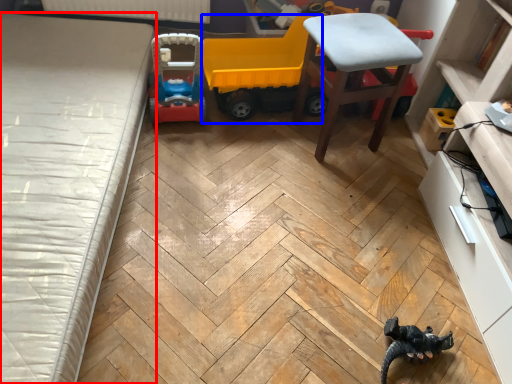
Question: Which point is closer to the camera, bed (highlighted by a red box) or model car (highlighted by a blue box)?

Choices:
 (A) bed
 (B) model car

Answer: (A)